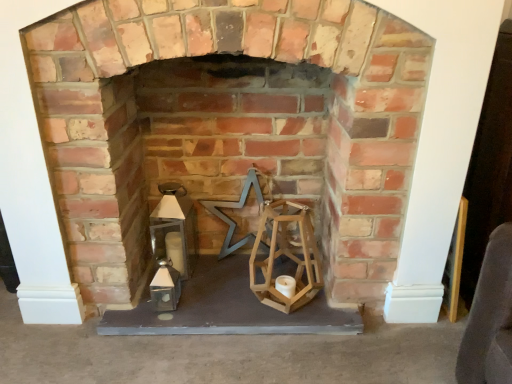
What do you see at coordinates (229, 127) in the screenshot?
I see `matte brick fireplace at center` at bounding box center [229, 127].

Where is `matte brick fireplace at center`? matte brick fireplace at center is located at coordinates [229, 127].

At what (x,y) coordinates should I click in order to perform the action: click on matte brick fireplace at center. Please return your answer as a coordinate pair (x, y). Looking at the image, I should click on (229, 127).